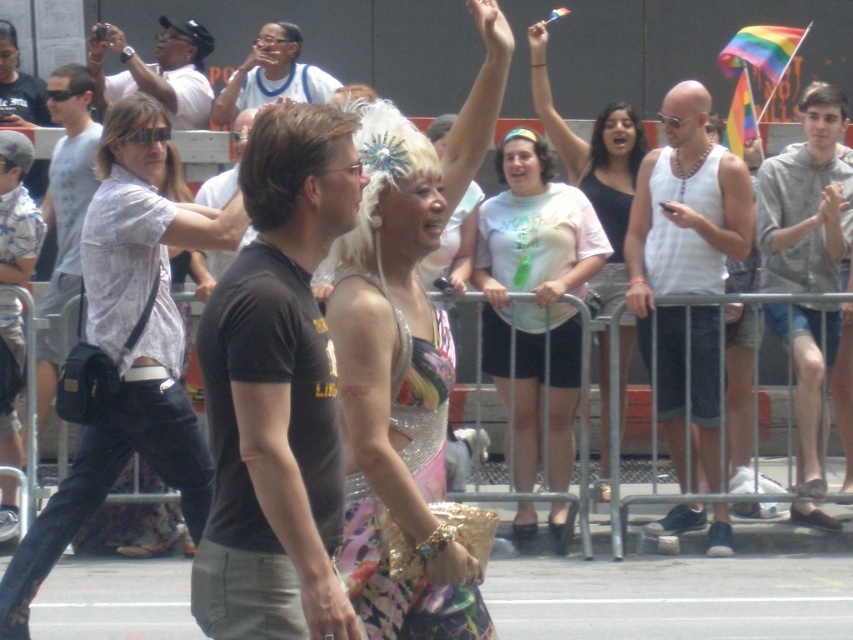
Question: Does white tank top at center appear over matte white shirt at center?

Choices:
 (A) no
 (B) yes

Answer: (A)

Question: Which point appears farthest from the camera in this image?

Choices:
 (A) (535, 93)
 (B) (379, 563)
 (C) (70, 250)

Answer: (A)

Question: Which object is positioned closest to the shiny sequined dress at center?

Choices:
 (A) brown cotton shirt at center
 (B) gray hoodie at upper right
 (C) matte white shirt at center

Answer: (A)

Question: Is gray hoodie at upper right thinner than matte blue tank top at center?

Choices:
 (A) no
 (B) yes

Answer: (B)

Question: Can you confirm if white t-shirt at center is thinner than gray hoodie at upper right?

Choices:
 (A) no
 (B) yes

Answer: (A)

Question: Estimate the real-world distances between objects in this image. Which object is closer to the white t-shirt at center?

Choices:
 (A) white tank top at center
 (B) shiny silver dress at center
 (C) matte white shirt at center

Answer: (C)